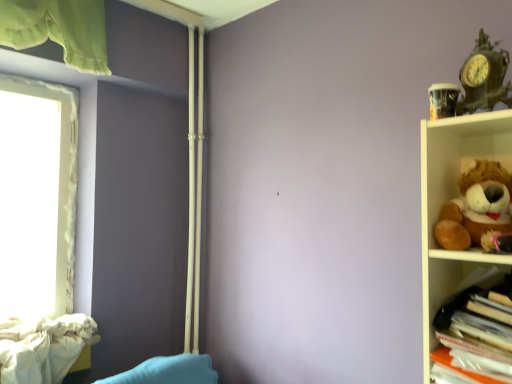
Question: Is translucent plastic folders at right facing away from white textured curtain at left?

Choices:
 (A) yes
 (B) no

Answer: (B)

Question: Does translucent plastic folders at right contain white textured curtain at left?

Choices:
 (A) no
 (B) yes

Answer: (A)

Question: From a real-world perspective, is translucent plastic folders at right under white textured curtain at left?

Choices:
 (A) no
 (B) yes

Answer: (B)

Question: Does translucent plastic folders at right turn towards white textured curtain at left?

Choices:
 (A) yes
 (B) no

Answer: (B)

Question: Is translucent plastic folders at right taller than white textured curtain at left?

Choices:
 (A) no
 (B) yes

Answer: (A)

Question: From the image's perspective, would you say translucent plastic folders at right is shown under white textured curtain at left?

Choices:
 (A) no
 (B) yes

Answer: (B)

Question: Is antique bronze clock at upper right, the 2th toy ordered from the bottom, further to camera compared to brown plush toy at right, the 1th toy in the bottom-to-top sequence?

Choices:
 (A) yes
 (B) no

Answer: (A)

Question: Does antique bronze clock at upper right, the 2th toy ordered from the bottom, touch brown plush toy at right, the 1th toy in the bottom-to-top sequence?

Choices:
 (A) yes
 (B) no

Answer: (B)

Question: Considering the relative sizes of antique bronze clock at upper right, the 2th toy ordered from the bottom, and brown plush toy at right, the 1th toy in the bottom-to-top sequence, in the image provided, is antique bronze clock at upper right, the 2th toy ordered from the bottom, taller than brown plush toy at right, the 1th toy in the bottom-to-top sequence,?

Choices:
 (A) yes
 (B) no

Answer: (B)

Question: Are antique bronze clock at upper right, the first toy from the top, and brown plush toy at right, the 1th toy in the bottom-to-top sequence, located far from each other?

Choices:
 (A) yes
 (B) no

Answer: (B)

Question: Considering the relative positions of antique bronze clock at upper right, the 2th toy ordered from the bottom, and brown plush toy at right, the second toy when ordered from top to bottom, in the image provided, is antique bronze clock at upper right, the 2th toy ordered from the bottom, in front of brown plush toy at right, the second toy when ordered from top to bottom,?

Choices:
 (A) no
 (B) yes

Answer: (A)

Question: From the image's perspective, is antique bronze clock at upper right, the 2th toy ordered from the bottom, under brown plush toy at right, the second toy when ordered from top to bottom?

Choices:
 (A) yes
 (B) no

Answer: (B)

Question: Does white textured curtain at left have a greater height compared to brown plush toy at right, the second toy when ordered from top to bottom?

Choices:
 (A) no
 (B) yes

Answer: (B)